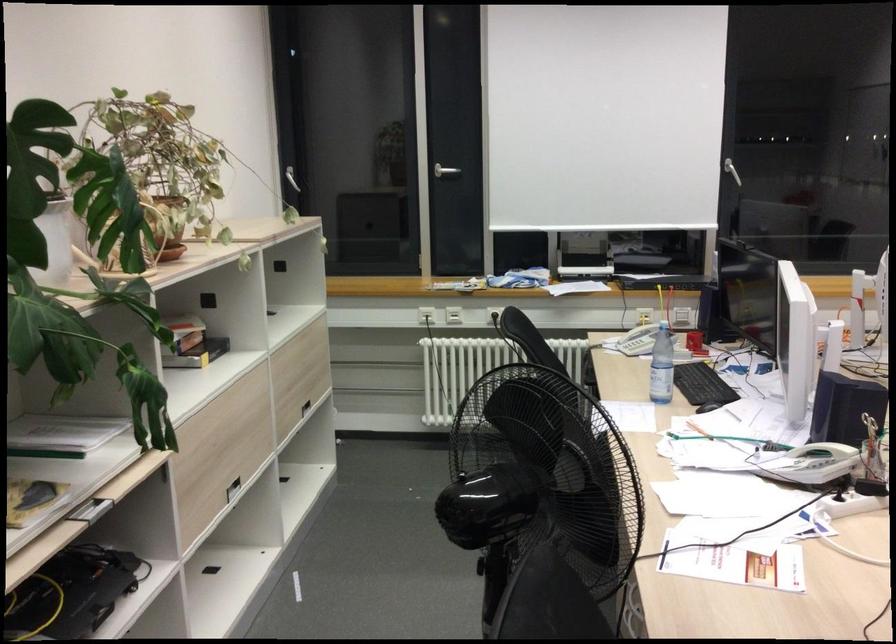
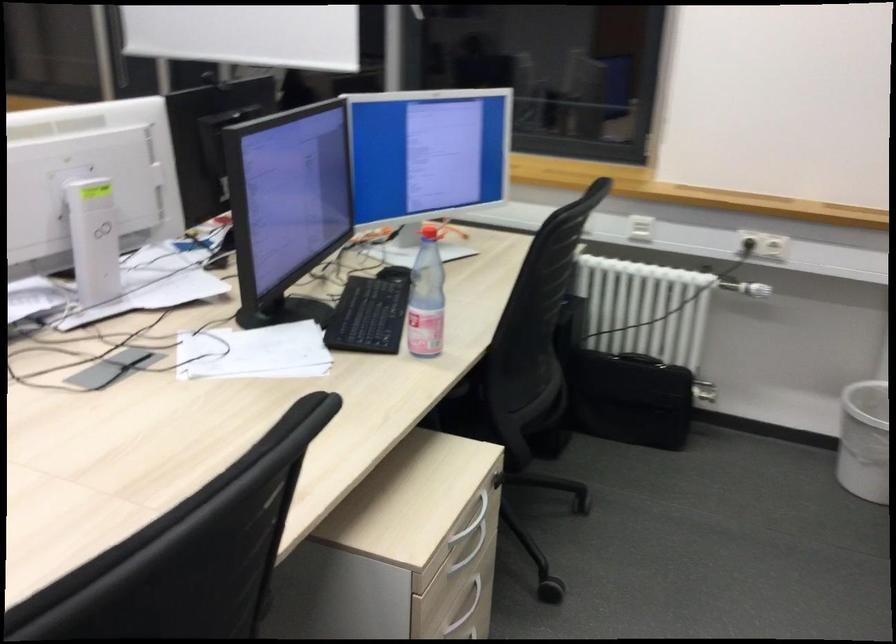
Which direction would the cameraman need to move to produce the second image?

The cameraman walked toward right, forward.